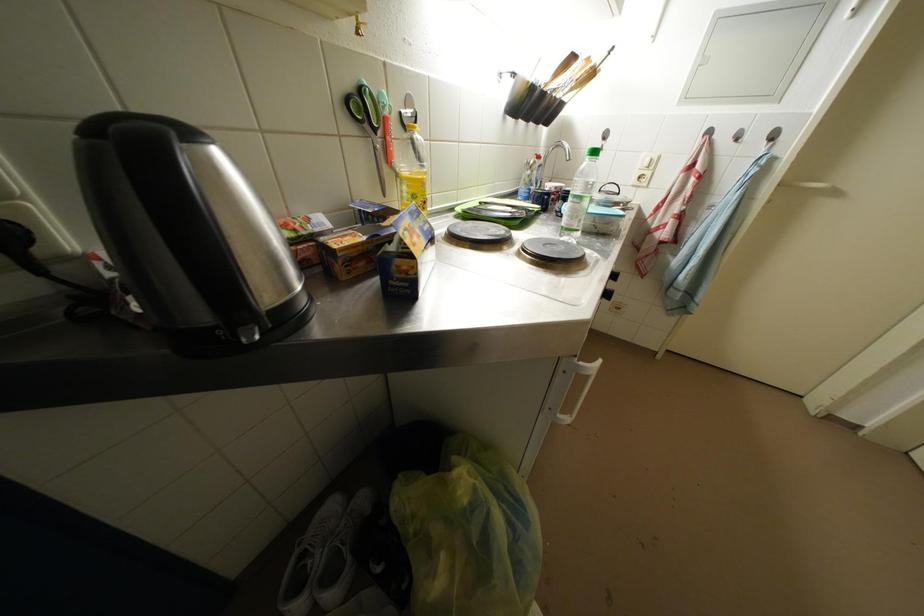
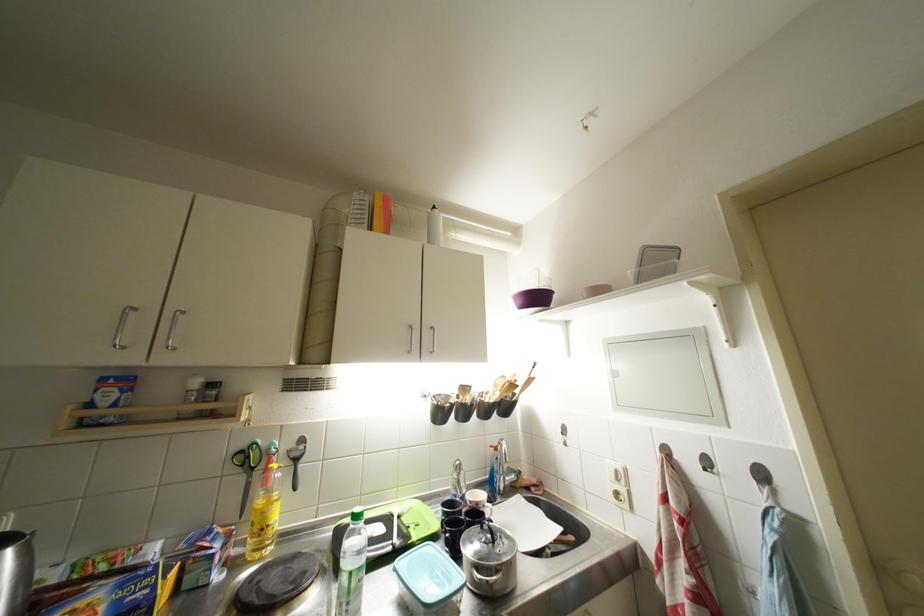
In the second image, find the point that corresponds to point (599, 78) in the first image.

(519, 390)